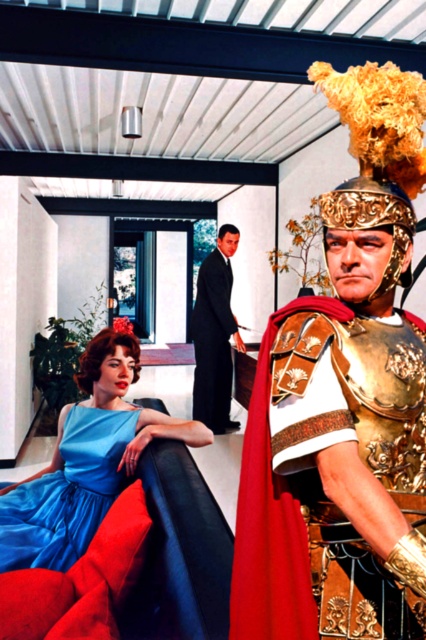
Question: Based on their relative distances, which object is nearer to the black suit at center?

Choices:
 (A) satin blue dress at lower left
 (B) satin blue dress at center

Answer: (B)

Question: Can you confirm if satin blue dress at lower left is positioned below black suit at center?

Choices:
 (A) no
 (B) yes

Answer: (B)

Question: Does satin blue dress at center lie in front of black suit at center?

Choices:
 (A) no
 (B) yes

Answer: (B)

Question: Among these points, which one is nearest to the camera?

Choices:
 (A) (288, 577)
 (B) (103, 458)
 (C) (32, 506)
 (D) (212, 268)

Answer: (A)

Question: Does satin blue dress at center have a smaller size compared to gold plated armor at center?

Choices:
 (A) yes
 (B) no

Answer: (B)

Question: Based on their relative distances, which object is nearer to the black suit at center?

Choices:
 (A) satin blue dress at lower left
 (B) satin blue dress at center
 (C) gold plated armor at center

Answer: (B)